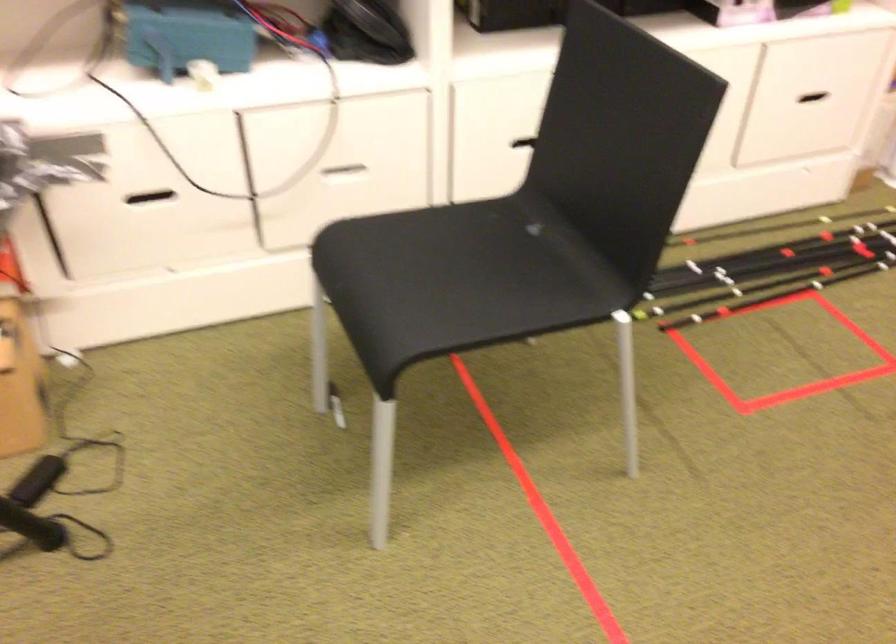
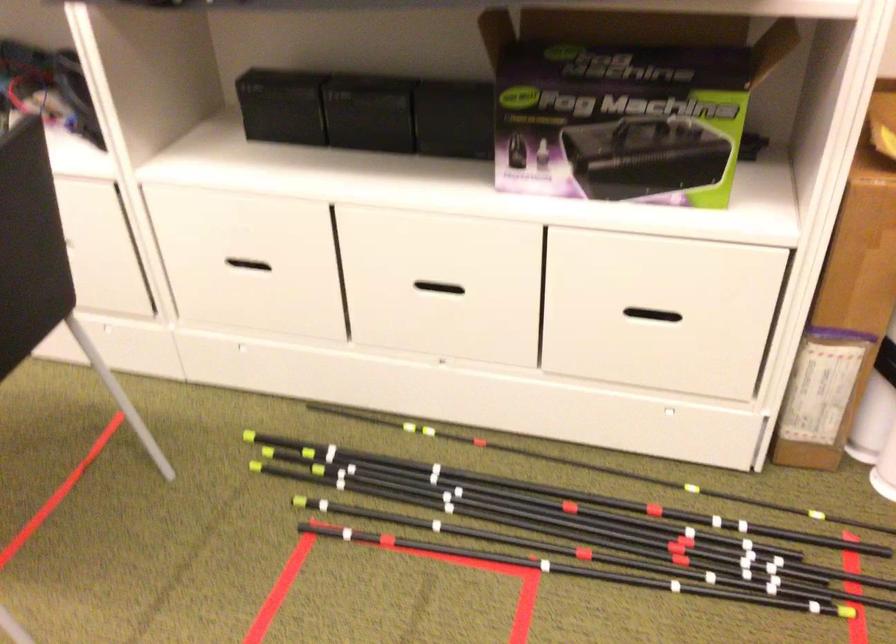
Where in the second image is the point corresponding to the point at 695,238 from the first image?

(493, 448)